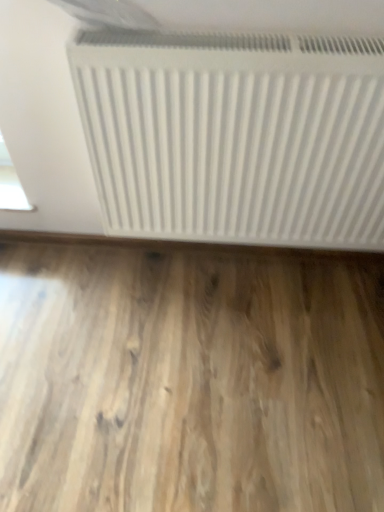
The width and height of the screenshot is (384, 512). I want to click on free region under white matte radiator at upper center (from a real-world perspective), so click(x=236, y=267).